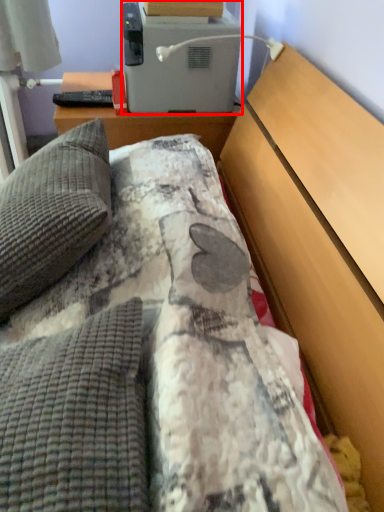
Question: Observing the image, what is the correct spatial positioning of appliance (annotated by the red box) in reference to pillow?

Choices:
 (A) left
 (B) right

Answer: (B)